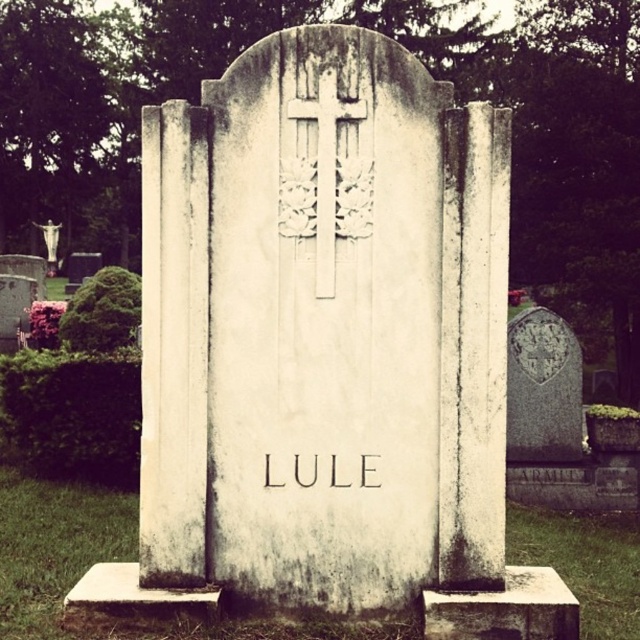
You are standing in a cemetery and see the white marble gravestone at center and the white carved wood cross at center. Which object is larger in size?

The white marble gravestone at center is bigger than the white carved wood cross at center.

You are standing at the entrance of the cemetery, which is at the bottom left corner of the image. You want to find the white marble gravestone at center. Which direction should you walk to reach it?

The white marble gravestone at center is located at point (504, 609), so you should walk towards the upper right direction from the entrance at the bottom left corner to reach it.

You are a landscape architect designing a new cemetery layout. You need to place a new path that must be at least 45 feet wide between the white marble gravestone at center and the white stone cross at upper center. Based on the current spacing, is this feasible?

The white marble gravestone at center and the white stone cross at upper center are 43.70 feet apart. Since the required path width is 45 feet, which is wider than the current spacing, it is not feasible to place the path as planned.